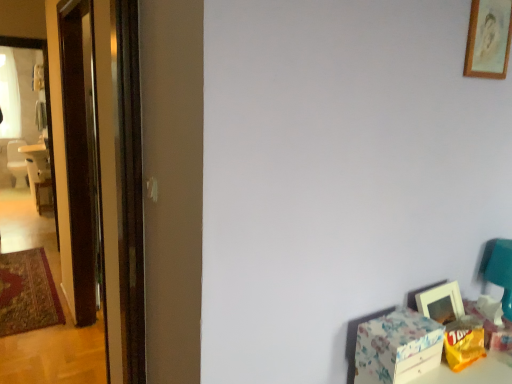
Question: Is matte white picture frame at lower right, the 2th picture frame in the top-to-bottom sequence, in front of or behind yellow paper bag at lower right, the 1th box in the right-to-left sequence, in the image?

Choices:
 (A) front
 (B) behind

Answer: (B)

Question: Considering the positions of matte white picture frame at lower right, which ranks as the first picture frame in bottom-to-top order, and yellow paper bag at lower right, the 1th box in the right-to-left sequence, in the image, is matte white picture frame at lower right, which ranks as the first picture frame in bottom-to-top order, bigger or smaller than yellow paper bag at lower right, the 1th box in the right-to-left sequence,?

Choices:
 (A) small
 (B) big

Answer: (B)

Question: Estimate the real-world distances between objects in this image. Which object is closer to the yellow paper bag at lower right, positioned as the 2th box in left-to-right order?

Choices:
 (A) floral paper box at lower right, which ranks as the second box in right-to-left order
 (B) matte white picture frame at lower right, which ranks as the first picture frame in bottom-to-top order
 (C) wooden frame at upper right, marked as the second picture frame in a bottom-to-top arrangement
 (D) transparent glass screen door at left
 (E) white plastic chair at left

Answer: (B)

Question: Which of these objects is positioned farthest from the white plastic chair at left?

Choices:
 (A) wooden frame at upper right, marked as the second picture frame in a bottom-to-top arrangement
 (B) transparent glass screen door at left
 (C) matte white picture frame at lower right, which ranks as the first picture frame in bottom-to-top order
 (D) yellow paper bag at lower right, the 1th box in the right-to-left sequence
 (E) floral paper box at lower right, which ranks as the second box in right-to-left order

Answer: (D)